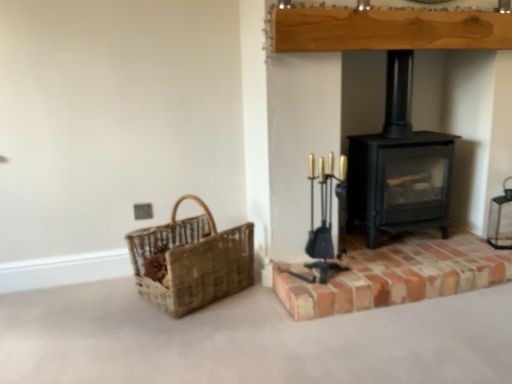
Question: Does black matte wood burning stove at center-right have a lesser width compared to brick at right?

Choices:
 (A) no
 (B) yes

Answer: (B)

Question: Is black matte wood burning stove at center-right in contact with brick at right?

Choices:
 (A) yes
 (B) no

Answer: (B)

Question: Is black matte wood burning stove at center-right outside brick at right?

Choices:
 (A) no
 (B) yes

Answer: (B)

Question: Is black matte wood burning stove at center-right shorter than brick at right?

Choices:
 (A) yes
 (B) no

Answer: (B)

Question: Is black matte wood burning stove at center-right at the left side of brick at right?

Choices:
 (A) no
 (B) yes

Answer: (B)

Question: Is black matte wood burning stove at center-right smaller than brick at right?

Choices:
 (A) yes
 (B) no

Answer: (B)

Question: Is brick at right smaller than woven natural basket at left?

Choices:
 (A) no
 (B) yes

Answer: (A)

Question: From a real-world perspective, is brick at right on woven natural basket at left?

Choices:
 (A) yes
 (B) no

Answer: (B)

Question: Are brick at right and woven natural basket at left beside each other?

Choices:
 (A) yes
 (B) no

Answer: (B)

Question: Is woven natural basket at left at the back of brick at right?

Choices:
 (A) yes
 (B) no

Answer: (B)

Question: Can we say brick at right lies outside woven natural basket at left?

Choices:
 (A) no
 (B) yes

Answer: (B)

Question: Are brick at right and woven natural basket at left far apart?

Choices:
 (A) no
 (B) yes

Answer: (A)

Question: Is woven natural basket at left not within black matte wood burning stove at center-right?

Choices:
 (A) no
 (B) yes

Answer: (B)